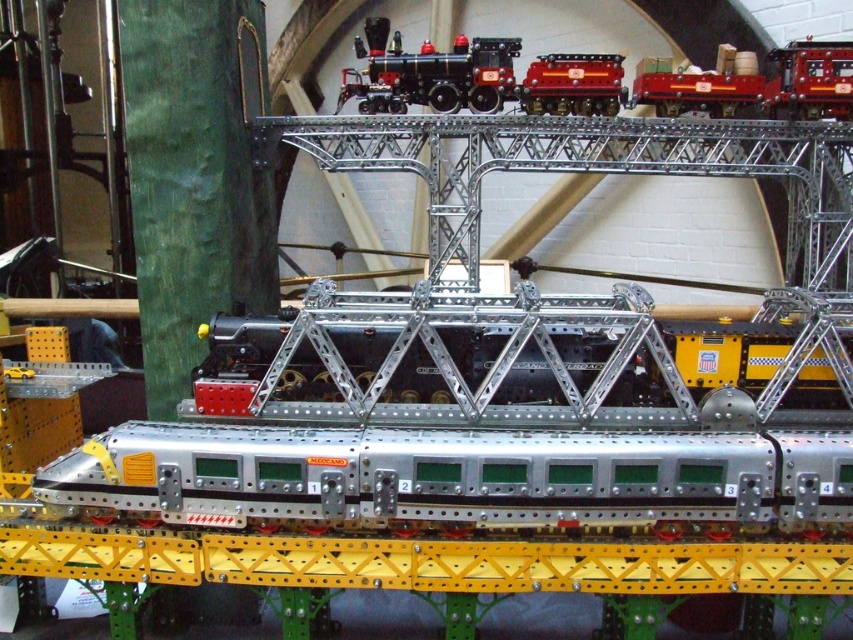
Between point (468, 92) and point (589, 86), which one is positioned behind?

The point (468, 92) is more distant.

Consider the image. Who is positioned more to the left, shiny black locomotive at upper center or shiny red metal train car at center?

Positioned to the left is shiny black locomotive at upper center.

Is point (496, 100) farther from camera compared to point (596, 81)?

Yes, point (496, 100) is behind point (596, 81).

This screenshot has height=640, width=853. Find the location of `shiny black locomotive at upper center`. shiny black locomotive at upper center is located at coordinates (430, 74).

Does metallic red wagon at upper right have a lesser width compared to shiny black locomotive at upper center?

Incorrect, metallic red wagon at upper right's width is not less than shiny black locomotive at upper center's.

The height and width of the screenshot is (640, 853). In order to click on metallic red wagon at upper right in this screenshot , I will do `click(756, 84)`.

Consider the image. Does silver metallic train at center have a smaller size compared to shiny black locomotive at upper center?

No.

Is point (596, 516) closer to camera compared to point (430, 84)?

Yes, point (596, 516) is in front of point (430, 84).

Is point (428, 516) farther from camera compared to point (421, 70)?

No, (428, 516) is in front of (421, 70).

Where is `silver metallic train at center`? The image size is (853, 640). silver metallic train at center is located at coordinates (456, 476).